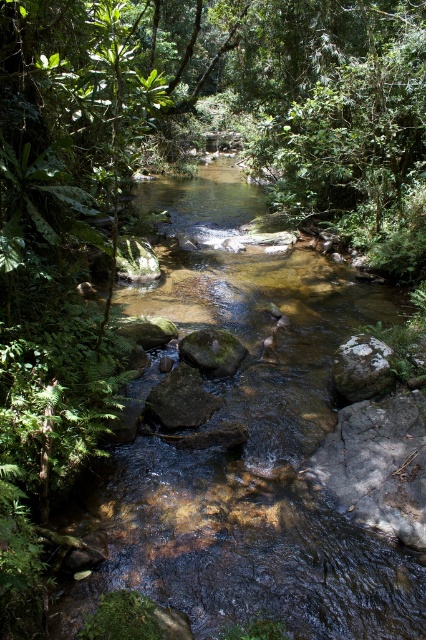
Is point (365, 573) in front of point (149, 410)?

That is True.

Does clear water stream at center have a greater width compared to smooth brown rock at center?

Yes.

At what (x,y) coordinates should I click in order to perform the action: click on clear water stream at center. Please return your answer as a coordinate pair (x, y). Looking at the image, I should click on (247, 468).

In the scene shown: How much distance is there between clear water stream at center and smooth gray rock at center?

A distance of 1.18 meters exists between clear water stream at center and smooth gray rock at center.

Who is taller, clear water stream at center or smooth gray rock at center?

With more height is clear water stream at center.

Between point (276, 348) and point (374, 378), which one is positioned behind?

Positioned behind is point (276, 348).

The image size is (426, 640). I want to click on clear water stream at center, so click(x=247, y=468).

Which of these two, smooth gray rock at center or green mossy rock at center, stands taller?

With more height is smooth gray rock at center.

Between point (351, 365) and point (184, 360), which one is positioned in front?

Point (351, 365) is in front.

At what (x,y) coordinates should I click in order to perform the action: click on smooth gray rock at center. Please return your answer as a coordinate pair (x, y). The image size is (426, 640). Looking at the image, I should click on (362, 369).

At what (x,y) coordinates should I click in order to perform the action: click on smooth gray rock at center. Please return your answer as a coordinate pair (x, y). The width and height of the screenshot is (426, 640). Looking at the image, I should click on (362, 369).